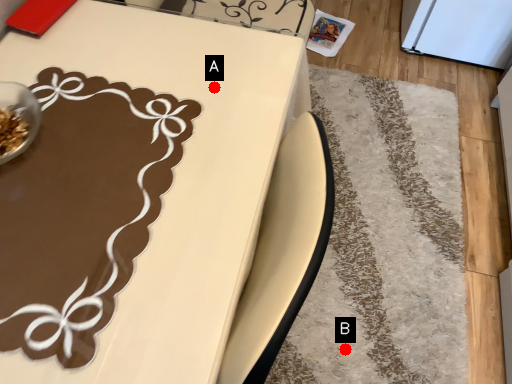
Question: Two points are circled on the image, labeled by A and B beside each circle. Which point is closer to the camera?

Choices:
 (A) A is closer
 (B) B is closer

Answer: (A)